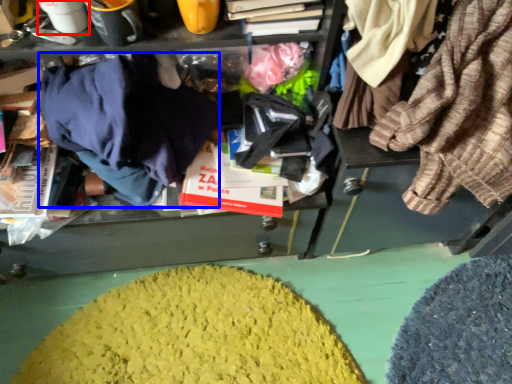
Question: Among these objects, which one is nearest to the camera, coffee cup (highlighted by a red box) or clothing (highlighted by a blue box)?

Choices:
 (A) coffee cup
 (B) clothing

Answer: (B)